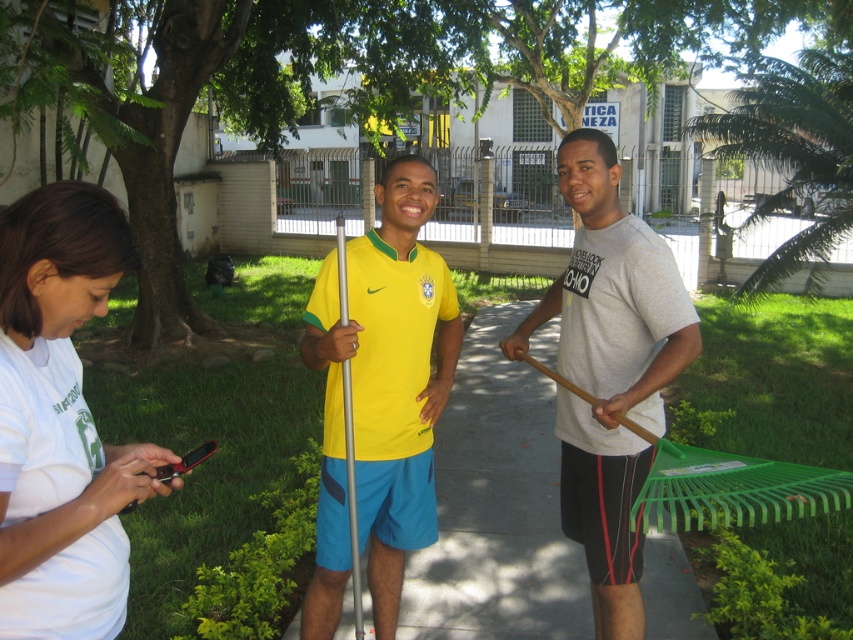
Question: Is white matte shirt at lower left to the right of yellow matte jersey at center from the viewer's perspective?

Choices:
 (A) yes
 (B) no

Answer: (B)

Question: Which point is farther to the camera?

Choices:
 (A) gray cotton t-shirt at center
 (B) smooth concrete pavement at center
 (C) white matte shirt at lower left

Answer: (B)

Question: Which object appears closest to the camera in this image?

Choices:
 (A) smooth concrete pavement at center
 (B) gray cotton t-shirt at center
 (C) yellow matte jersey at center
 (D) white matte shirt at lower left

Answer: (D)

Question: Can you confirm if yellow matte jersey at center is smaller than gray cotton t-shirt at center?

Choices:
 (A) yes
 (B) no

Answer: (B)

Question: Which object is farther from the camera taking this photo?

Choices:
 (A) smooth concrete pavement at center
 (B) white matte shirt at lower left
 (C) gray cotton t-shirt at center

Answer: (A)

Question: Can you confirm if smooth concrete pavement at center is bigger than yellow matte jersey at center?

Choices:
 (A) no
 (B) yes

Answer: (A)